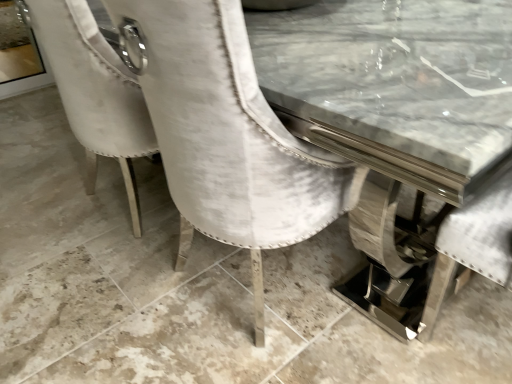
At what (x,y) coordinates should I click in order to perform the action: click on velvet white chair at center. Please return your answer as a coordinate pair (x, y). The image size is (512, 384). Looking at the image, I should click on (228, 135).

What do you see at coordinates (228, 135) in the screenshot? The height and width of the screenshot is (384, 512). I see `velvet white chair at center` at bounding box center [228, 135].

Locate an element on the screen. The image size is (512, 384). velvet white chair at center is located at coordinates (228, 135).